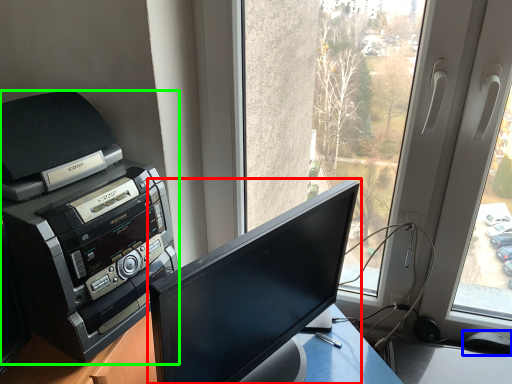
Question: Estimate the real-world distances between objects in this image. Which object is farther from computer monitor (highlighted by a red box), mouse (highlighted by a blue box) or printer (highlighted by a green box)?

Choices:
 (A) mouse
 (B) printer

Answer: (A)